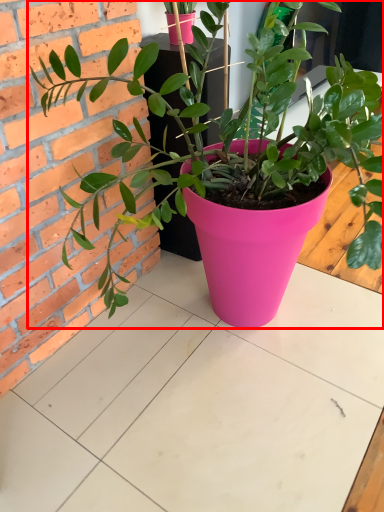
Question: From the image's perspective, where is houseplant (annotated by the red box) located relative to table?

Choices:
 (A) above
 (B) below

Answer: (A)